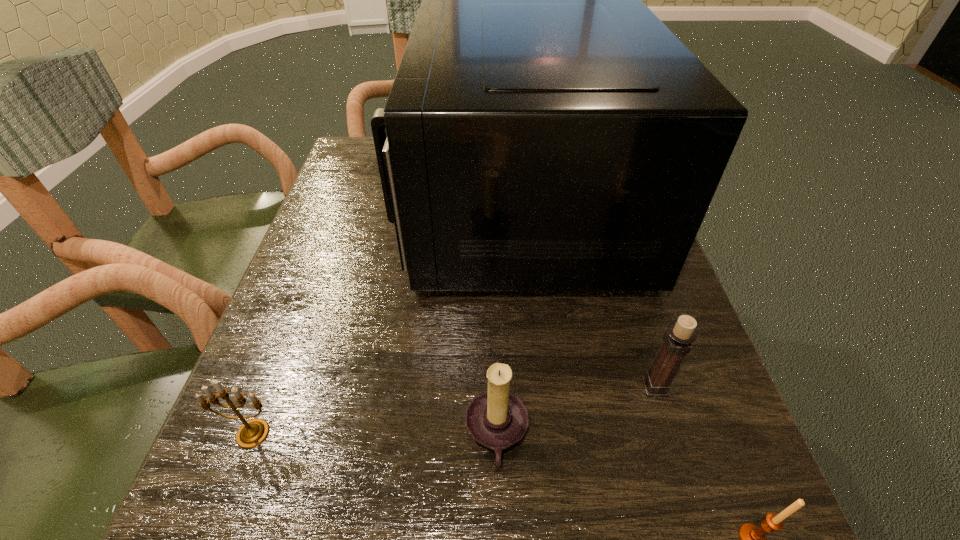
At what (x,y) coordinates should I click in order to perform the action: click on object that is the second closest to the third candle_holder from right to left. Please return your answer as a coordinate pair (x, y). The width and height of the screenshot is (960, 540). Looking at the image, I should click on (545, 131).

Where is `candle_holder that is the third closest to the second farthest object`? The height and width of the screenshot is (540, 960). candle_holder that is the third closest to the second farthest object is located at coordinates (252, 433).

Identify the location of the second closest candle_holder to the farthest candle_holder. Image resolution: width=960 pixels, height=540 pixels. (496, 418).